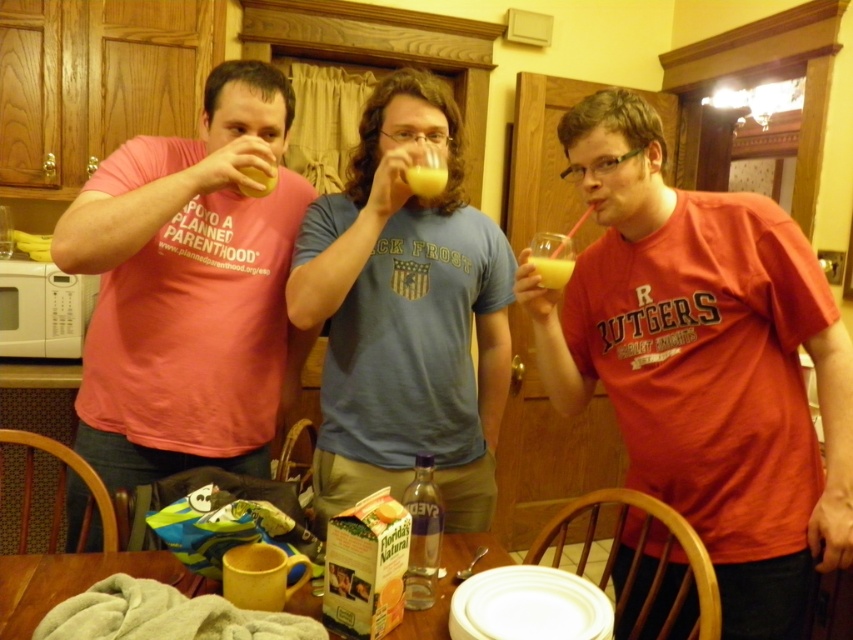
Is wooden table at lower center below clear glass bottle at center?

Yes.

Between wooden table at lower center and clear glass bottle at center, which one appears on the right side from the viewer's perspective?

Positioned to the right is clear glass bottle at center.

The height and width of the screenshot is (640, 853). Find the location of `wooden table at lower center`. wooden table at lower center is located at coordinates (68, 580).

This screenshot has width=853, height=640. Identify the location of wooden table at lower center. (68, 580).

Who is more forward, [20,611] or [4,307]?

Point [20,611] is more forward.

Is wooden table at lower center to the left of white matte microwave at left from the viewer's perspective?

In fact, wooden table at lower center is to the right of white matte microwave at left.

What do you see at coordinates (68, 580) in the screenshot? I see `wooden table at lower center` at bounding box center [68, 580].

The image size is (853, 640). Find the location of `wooden table at lower center`. wooden table at lower center is located at coordinates (68, 580).

From the picture: Which of these two, matte red t-shirt at center or white matte microwave at left, stands shorter?

white matte microwave at left

Is matte red t-shirt at center positioned at the back of white matte microwave at left?

No, it is in front of white matte microwave at left.

Is point (788, 500) positioned behind point (57, 314)?

No, (788, 500) is in front of (57, 314).

Locate an element on the screen. The height and width of the screenshot is (640, 853). matte red t-shirt at center is located at coordinates pos(704,362).